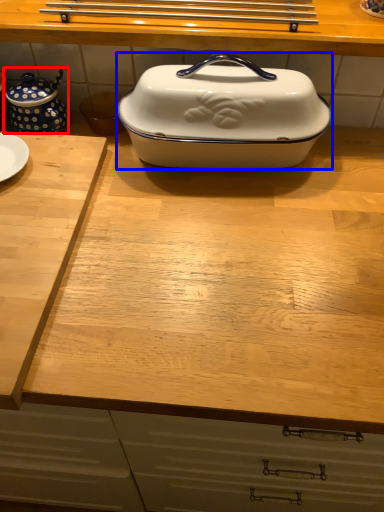
Question: Among these objects, which one is nearest to the camera, tea pot (highlighted by a red box) or kitchen appliance (highlighted by a blue box)?

Choices:
 (A) tea pot
 (B) kitchen appliance

Answer: (B)